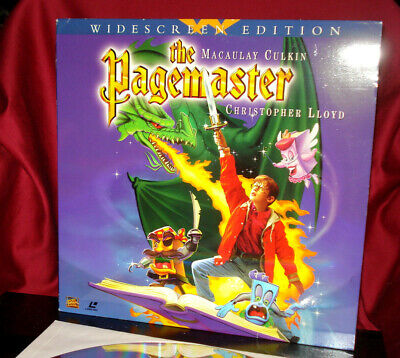
Where is `box`? The height and width of the screenshot is (358, 400). box is located at coordinates (169, 272).